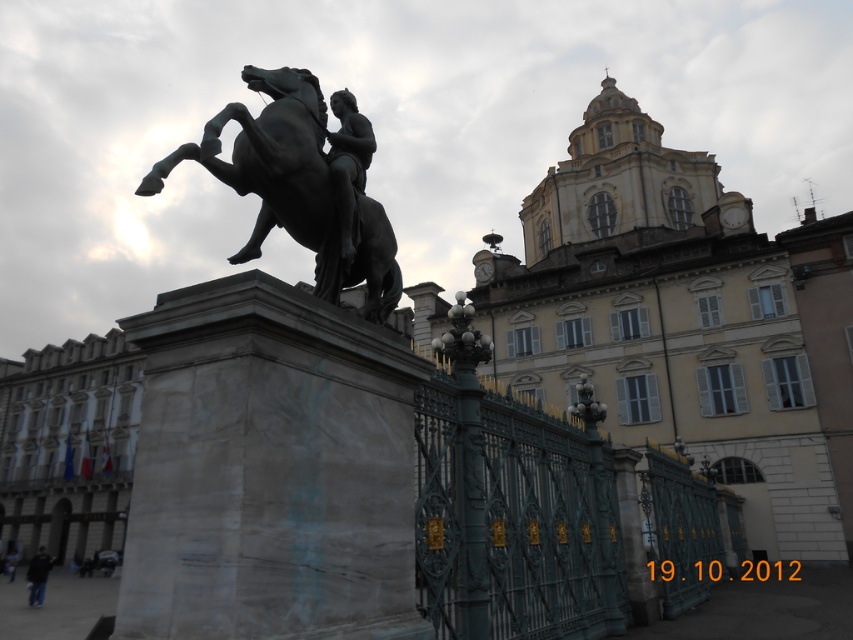
Is green wrought iron fence at center shorter than polished bronze statue at center?

No, green wrought iron fence at center is not shorter than polished bronze statue at center.

Describe the element at coordinates (514, 515) in the screenshot. This screenshot has width=853, height=640. I see `green wrought iron fence at center` at that location.

Is point (701, 579) positioned after point (349, 93)?

Yes.

Where is `green wrought iron fence at center`? This screenshot has width=853, height=640. green wrought iron fence at center is located at coordinates (514, 515).

Is yellow stone building at upper center taller than polished bronze statue at center?

Yes, yellow stone building at upper center is taller than polished bronze statue at center.

Is point (693, 336) in front of point (328, 157)?

No, (693, 336) is further to viewer.

Is point (816, 515) positioned after point (337, 179)?

Yes, it is behind point (337, 179).

You are a GUI agent. You are given a task and a screenshot of the screen. Output one action in this format:
    pyautogui.click(x=<x>, y=<y>)
    Task: Click on the yellow stone building at upper center
    Image resolution: width=853 pixels, height=640 pixels.
    Given the screenshot: What is the action you would take?
    pyautogui.click(x=666, y=321)

Between polished bronze statue at center and dark gray jacket at lower left, which one appears on the right side from the viewer's perspective?

polished bronze statue at center is more to the right.

Measure the distance between polished bronze statue at center and dark gray jacket at lower left.

polished bronze statue at center is 210.82 feet away from dark gray jacket at lower left.

Between point (341, 170) and point (28, 595), which one is positioned in front?

Point (341, 170)

This screenshot has height=640, width=853. In order to click on polished bronze statue at center in this screenshot , I will do `click(347, 164)`.